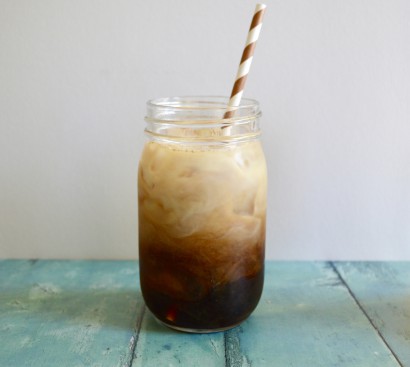
The image size is (410, 367). I want to click on clear glass jar, so click(x=217, y=154).